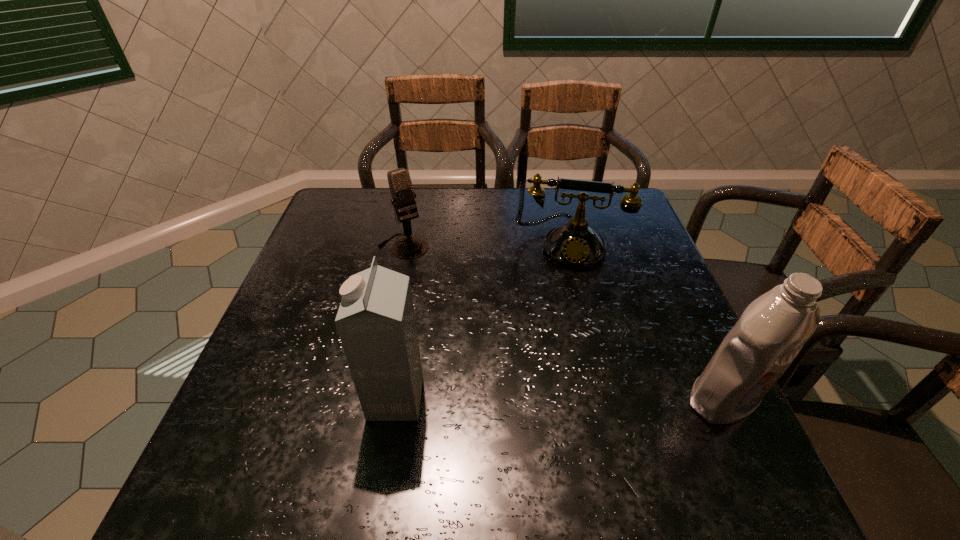
Locate an element on the screen. vacant space on the desktop that is between the carton and the detergent and is positioned on the front-facing side of the microphone is located at coordinates (512, 399).

Where is `free space on the desktop that is between the carton and the detergent and is positioned on the dial of the telephone`? free space on the desktop that is between the carton and the detergent and is positioned on the dial of the telephone is located at coordinates (558, 399).